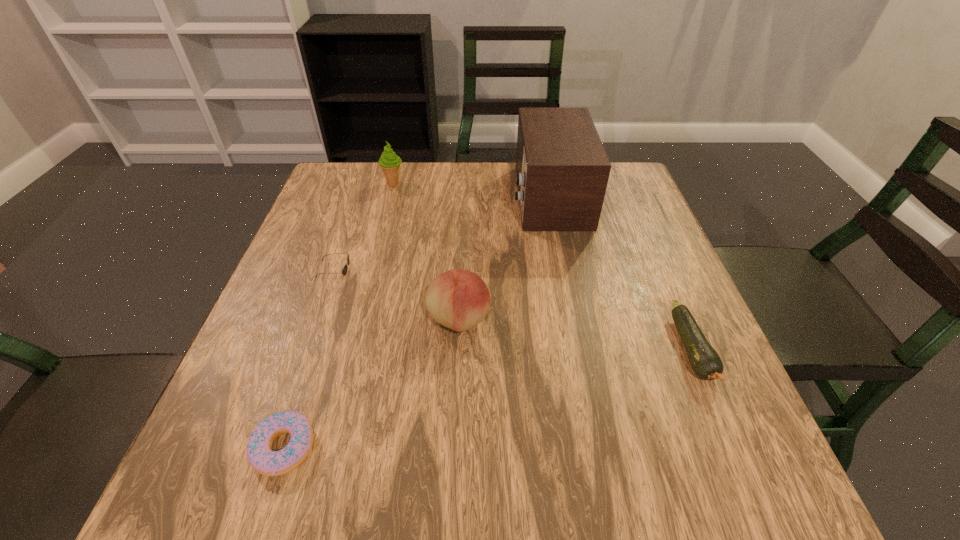
You are a GUI agent. You are given a task and a screenshot of the screen. Output one action in this format:
    pyautogui.click(x=<x>, y=<y>)
    Task: Click on the vacant space at the near edge of the desktop
    
    Given the screenshot: What is the action you would take?
    pyautogui.click(x=507, y=472)

In the image, there is a desktop. Where is `free region at the left edge`? free region at the left edge is located at coordinates (331, 219).

Where is `vacant area at the right edge`? vacant area at the right edge is located at coordinates tap(638, 223).

The height and width of the screenshot is (540, 960). I want to click on free point at the far left corner, so click(x=382, y=172).

Locate an element on the screen. The width and height of the screenshot is (960, 540). vacant space at the near left corner of the desktop is located at coordinates (203, 467).

In the image, there is a desktop. Identify the location of vacant space at the far right corner. (612, 173).

The image size is (960, 540). In order to click on empty space that is in between the shortest object and the fourth shortest object in this screenshot , I will do `click(372, 383)`.

What are the coordinates of `free spot between the fifth object from left to right and the shortest object` in the screenshot? It's located at (417, 322).

Image resolution: width=960 pixels, height=540 pixels. What are the coordinates of `vacant area that lies between the third shortest object and the second tallest object` in the screenshot? It's located at (366, 233).

The width and height of the screenshot is (960, 540). What are the coordinates of `unoccupied position between the fourth tallest object and the fifth tallest object` in the screenshot? It's located at (516, 316).